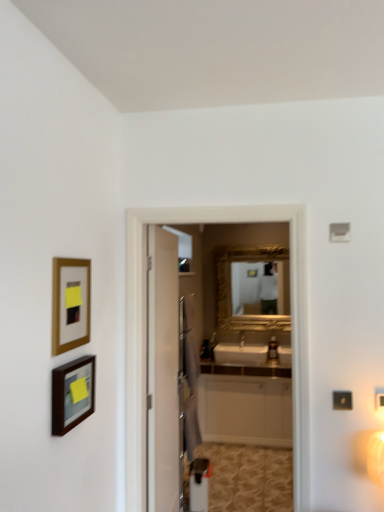
Question: Considering the relative sizes of gold-framed picture at left, which is counted as the 1th picture frame, starting from the top, and matte black picture frame at lower left, arranged as the first picture frame when ordered from the bottom, in the image provided, is gold-framed picture at left, which is counted as the 1th picture frame, starting from the top, smaller than matte black picture frame at lower left, arranged as the first picture frame when ordered from the bottom,?

Choices:
 (A) no
 (B) yes

Answer: (B)

Question: Could you tell me if gold-framed picture at left, which is counted as the 2th picture frame, starting from the bottom, is facing matte black picture frame at lower left, which ranks as the 2th picture frame in top-to-bottom order?

Choices:
 (A) yes
 (B) no

Answer: (B)

Question: Is gold-framed picture at left, which is counted as the 1th picture frame, starting from the top, further to the viewer compared to matte black picture frame at lower left, arranged as the first picture frame when ordered from the bottom?

Choices:
 (A) yes
 (B) no

Answer: (A)

Question: Can you confirm if gold-framed picture at left, which is counted as the 2th picture frame, starting from the bottom, is bigger than matte black picture frame at lower left, which ranks as the 2th picture frame in top-to-bottom order?

Choices:
 (A) no
 (B) yes

Answer: (A)

Question: Considering the relative sizes of gold-framed picture at left, which is counted as the 2th picture frame, starting from the bottom, and matte black picture frame at lower left, arranged as the first picture frame when ordered from the bottom, in the image provided, is gold-framed picture at left, which is counted as the 2th picture frame, starting from the bottom, shorter than matte black picture frame at lower left, arranged as the first picture frame when ordered from the bottom,?

Choices:
 (A) yes
 (B) no

Answer: (B)

Question: Does point (203, 408) appear closer or farther from the camera than point (125, 508)?

Choices:
 (A) closer
 (B) farther

Answer: (B)

Question: In the image, is white glossy cabinet at center positioned in front of or behind white glossy screen door at center?

Choices:
 (A) behind
 (B) front

Answer: (A)

Question: In the image, is white glossy cabinet at center on the left side or the right side of white glossy screen door at center?

Choices:
 (A) right
 (B) left

Answer: (A)

Question: Is white glossy cabinet at center taller or shorter than white glossy screen door at center?

Choices:
 (A) short
 (B) tall

Answer: (A)

Question: Considering the positions of point (54, 290) and point (125, 451), is point (54, 290) closer or farther from the camera than point (125, 451)?

Choices:
 (A) farther
 (B) closer

Answer: (B)

Question: From a real-world perspective, relative to white glossy screen door at center, is gold-framed picture at left, which is counted as the 2th picture frame, starting from the bottom, vertically above or below?

Choices:
 (A) below
 (B) above

Answer: (B)

Question: Considering the positions of gold-framed picture at left, which is counted as the 2th picture frame, starting from the bottom, and white glossy screen door at center in the image, is gold-framed picture at left, which is counted as the 2th picture frame, starting from the bottom, taller or shorter than white glossy screen door at center?

Choices:
 (A) short
 (B) tall

Answer: (A)

Question: From the image's perspective, is gold-framed picture at left, which is counted as the 1th picture frame, starting from the top, located above or below white glossy screen door at center?

Choices:
 (A) above
 (B) below

Answer: (A)

Question: Is white glossy screen door at center in front of or behind matte black picture frame at lower left, which ranks as the 2th picture frame in top-to-bottom order, in the image?

Choices:
 (A) front
 (B) behind

Answer: (B)

Question: Looking at their shapes, would you say white glossy screen door at center is wider or thinner than matte black picture frame at lower left, arranged as the first picture frame when ordered from the bottom?

Choices:
 (A) thin
 (B) wide

Answer: (B)